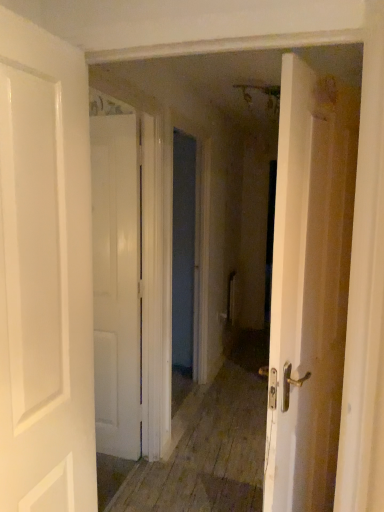
What is the approximate height of white glossy door at left, which appears as the first door when viewed from the front?

It is 1.54 meters.

What are the coordinates of `white glossy door at left, which appears as the first door when viewed from the front` in the screenshot? It's located at (45, 274).

The image size is (384, 512). What do you see at coordinates (45, 274) in the screenshot?
I see `white glossy door at left, which appears as the first door when viewed from the front` at bounding box center [45, 274].

This screenshot has height=512, width=384. What do you see at coordinates (116, 283) in the screenshot?
I see `white matte door at center, the first door positioned from the back` at bounding box center [116, 283].

Locate an element on the screen. The height and width of the screenshot is (512, 384). white matte door at center, which ranks as the 2th door in front-to-back order is located at coordinates (116, 283).

Identify the location of white glossy door at left, arranged as the 2th door when viewed from the back. Image resolution: width=384 pixels, height=512 pixels. (45, 274).

Which is more to the right, white glossy door at left, which appears as the first door when viewed from the front, or white matte door at center, the first door positioned from the back?

Positioned to the right is white matte door at center, the first door positioned from the back.

Is white glossy door at left, arranged as the 2th door when viewed from the back, positioned in front of white matte door at center, the first door positioned from the back?

Yes, white glossy door at left, arranged as the 2th door when viewed from the back, is in front of white matte door at center, the first door positioned from the back.

Does point (7, 334) appear closer or farther from the camera than point (112, 224)?

Clearly, point (7, 334) is closer to the camera than point (112, 224).

From the image's perspective, is white glossy door at left, which appears as the first door when viewed from the front, over white matte door at center, the first door positioned from the back?

Indeed, from the image's perspective, white glossy door at left, which appears as the first door when viewed from the front, is shown above white matte door at center, the first door positioned from the back.

From a real-world perspective, does white glossy door at left, arranged as the 2th door when viewed from the back, stand above white matte door at center, the first door positioned from the back?

Indeed, from a real-world perspective, white glossy door at left, arranged as the 2th door when viewed from the back, stands above white matte door at center, the first door positioned from the back.

Does white glossy door at left, arranged as the 2th door when viewed from the back, have a lesser width compared to white matte door at center, the first door positioned from the back?

In fact, white glossy door at left, arranged as the 2th door when viewed from the back, might be wider than white matte door at center, the first door positioned from the back.

Can you confirm if white glossy door at left, arranged as the 2th door when viewed from the back, is taller than white matte door at center, the first door positioned from the back?

No.

Between white glossy door at left, arranged as the 2th door when viewed from the back, and white matte door at center, which ranks as the 2th door in front-to-back order, which one has smaller size?

white matte door at center, which ranks as the 2th door in front-to-back order, is smaller.

Is white glossy door at left, which appears as the first door when viewed from the front, situated inside white matte door at center, which ranks as the 2th door in front-to-back order, or outside?

The correct answer is: outside.

Is white glossy door at left, which appears as the first door when viewed from the front, with white matte door at center, the first door positioned from the back?

There is a gap between white glossy door at left, which appears as the first door when viewed from the front, and white matte door at center, the first door positioned from the back.

Is white glossy door at left, arranged as the 2th door when viewed from the back, positioned with its back to white matte door at center, the first door positioned from the back?

white glossy door at left, arranged as the 2th door when viewed from the back, is not turned away from white matte door at center, the first door positioned from the back.

How many degrees apart are the facing directions of white glossy door at left, which appears as the first door when viewed from the front, and white matte door at center, which ranks as the 2th door in front-to-back order?

The angle between the facing direction of white glossy door at left, which appears as the first door when viewed from the front, and the facing direction of white matte door at center, which ranks as the 2th door in front-to-back order, is 90.2 degrees.

Measure the distance between white glossy door at left, arranged as the 2th door when viewed from the back, and white matte door at center, the first door positioned from the back.

white glossy door at left, arranged as the 2th door when viewed from the back, is 1.12 meters away from white matte door at center, the first door positioned from the back.

In order to click on door in front of the white matte door at center, the first door positioned from the back in this screenshot , I will do `click(45, 274)`.

Which object is positioned more to the left, white matte door at center, which ranks as the 2th door in front-to-back order, or white glossy door at left, which appears as the first door when viewed from the front?

From the viewer's perspective, white glossy door at left, which appears as the first door when viewed from the front, appears more on the left side.

Considering the positions of objects white matte door at center, the first door positioned from the back, and white glossy door at left, arranged as the 2th door when viewed from the back, in the image provided, who is in front, white matte door at center, the first door positioned from the back, or white glossy door at left, arranged as the 2th door when viewed from the back,?

white glossy door at left, arranged as the 2th door when viewed from the back, is in front.

Which is behind, point (101, 121) or point (44, 298)?

Point (101, 121)

From the image's perspective, is white matte door at center, which ranks as the 2th door in front-to-back order, under white glossy door at left, which appears as the first door when viewed from the front?

Yes, from the image's perspective, white matte door at center, which ranks as the 2th door in front-to-back order, is beneath white glossy door at left, which appears as the first door when viewed from the front.

From a real-world perspective, who is located higher, white matte door at center, the first door positioned from the back, or white glossy door at left, which appears as the first door when viewed from the front?

From a 3D spatial view, white glossy door at left, which appears as the first door when viewed from the front, is above.

Does white matte door at center, which ranks as the 2th door in front-to-back order, have a greater width compared to white glossy door at left, which appears as the first door when viewed from the front?

No.

From the picture: In terms of height, does white matte door at center, which ranks as the 2th door in front-to-back order, look taller or shorter compared to white glossy door at left, arranged as the 2th door when viewed from the back?

Clearly, white matte door at center, which ranks as the 2th door in front-to-back order, is taller compared to white glossy door at left, arranged as the 2th door when viewed from the back.

Based on their sizes in the image, would you say white matte door at center, the first door positioned from the back, is bigger or smaller than white glossy door at left, which appears as the first door when viewed from the front?

Considering their sizes, white matte door at center, the first door positioned from the back, takes up less space than white glossy door at left, which appears as the first door when viewed from the front.

Is white matte door at center, the first door positioned from the back, located outside white glossy door at left, arranged as the 2th door when viewed from the back?

Yes, white matte door at center, the first door positioned from the back, is not within white glossy door at left, arranged as the 2th door when viewed from the back.

Is white matte door at center, the first door positioned from the back, touching white glossy door at left, arranged as the 2th door when viewed from the back?

No, white matte door at center, the first door positioned from the back, is not next to white glossy door at left, arranged as the 2th door when viewed from the back.

Is white matte door at center, the first door positioned from the back, oriented towards white glossy door at left, which appears as the first door when viewed from the front?

No.

Measure the distance between white matte door at center, which ranks as the 2th door in front-to-back order, and white glossy door at left, arranged as the 2th door when viewed from the back.

white matte door at center, which ranks as the 2th door in front-to-back order, and white glossy door at left, arranged as the 2th door when viewed from the back, are 1.12 meters apart.

I want to click on door located underneath the white glossy door at left, arranged as the 2th door when viewed from the back (from a real-world perspective), so click(116, 283).

Identify the location of door that is on the left side of white matte door at center, the first door positioned from the back. This screenshot has width=384, height=512. (45, 274).

Where is `door that is under the white glossy door at left, arranged as the 2th door when viewed from the back (from a real-world perspective)`? The image size is (384, 512). door that is under the white glossy door at left, arranged as the 2th door when viewed from the back (from a real-world perspective) is located at coordinates (116, 283).